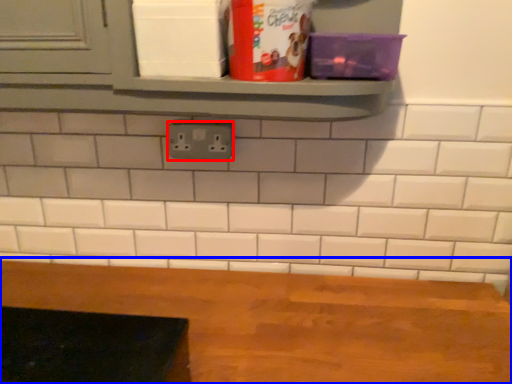
Question: Which object appears closest to the camera in this image, electric outlet (highlighted by a red box) or table (highlighted by a blue box)?

Choices:
 (A) electric outlet
 (B) table

Answer: (B)